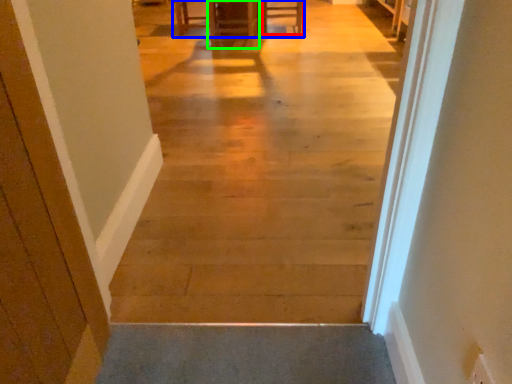
Question: Which object is the closest to the furniture (highlighted by a red box)? Choose among these: table (highlighted by a blue box) or furniture (highlighted by a green box).

Choices:
 (A) table
 (B) furniture

Answer: (B)